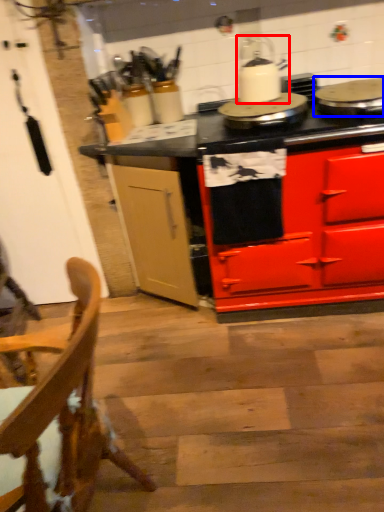
Question: Which object appears closest to the camera in this image, kitchen appliance (highlighted by a red box) or appliance (highlighted by a blue box)?

Choices:
 (A) kitchen appliance
 (B) appliance

Answer: (B)